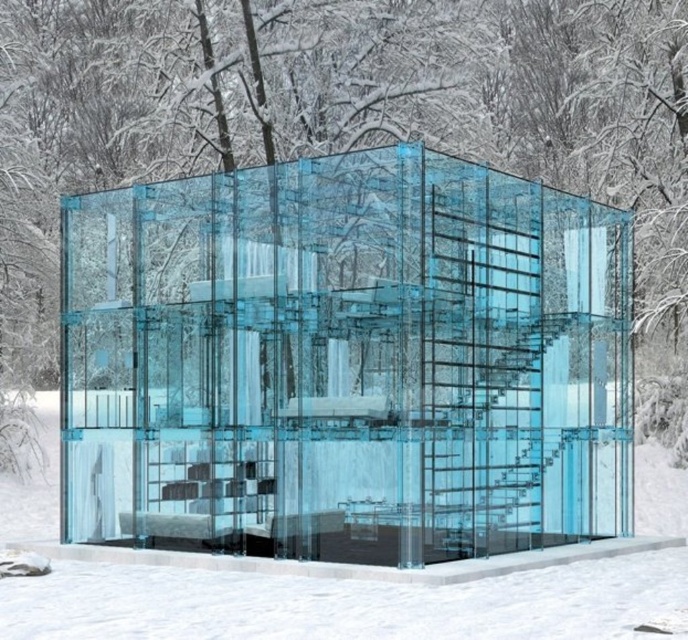
You are an architect designing a new winter exhibition space. You need to determine if the transparent glass cube at center can be placed on top of the transparent glass snow at center without exceeding the snow base height. Based on the scene description, can you confirm if the cube will fit within the snow base height?

The transparent glass cube at center has a greater height compared to transparent glass snow at center. Therefore, placing the transparent glass cube at center on top of the transparent glass snow at center would exceed the snow base height, making it impossible to fit within the snow base height.

You are an architect designing a new winter structure. You need to choose between the transparent glass cube at center and the transparent glass snow at center for a part of your design that requires a thicker material. Which one should you choose?

You should choose the transparent glass snow at center because it is thicker than the transparent glass cube at center according to the description.